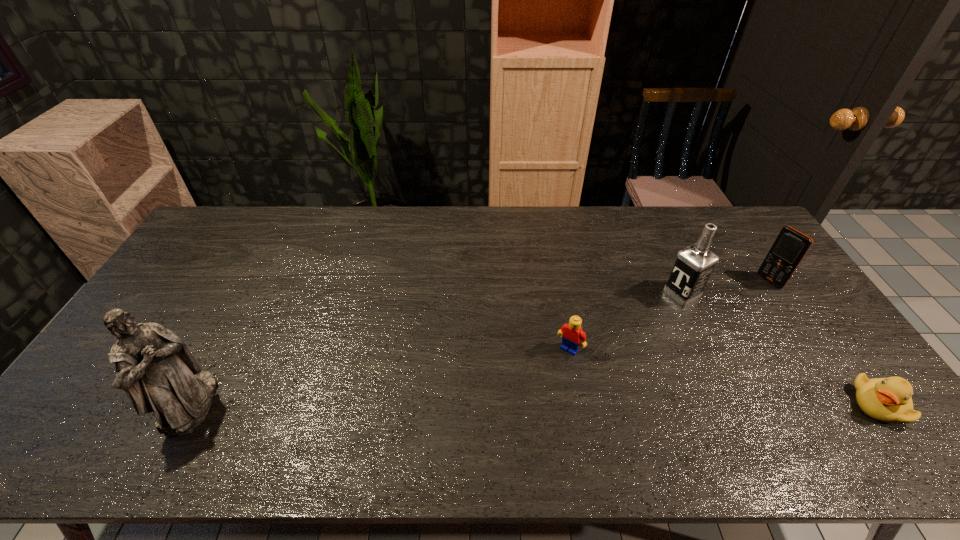
At what (x,y) coordinates should I click in order to perform the action: click on vacant space on the desktop that is between the figurine and the shortest object and is positioned on the face of the Lego. Please return your answer as a coordinate pair (x, y). The width and height of the screenshot is (960, 540). Looking at the image, I should click on (533, 404).

The width and height of the screenshot is (960, 540). I want to click on vacant spot on the desktop that is between the tallest object and the shortest object and is positioned on the front label of the second tallest object, so click(x=479, y=404).

At what (x,y) coordinates should I click in order to perform the action: click on free spot on the desktop that is between the figurine and the shortest object and is positioned on the screen of the cellular telephone. Please return your answer as a coordinate pair (x, y). The width and height of the screenshot is (960, 540). Looking at the image, I should click on (563, 404).